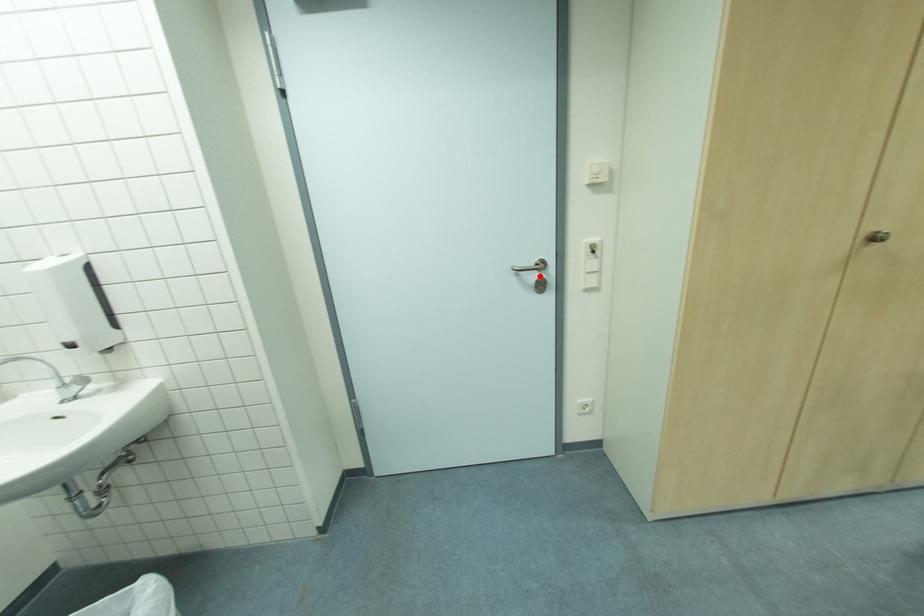
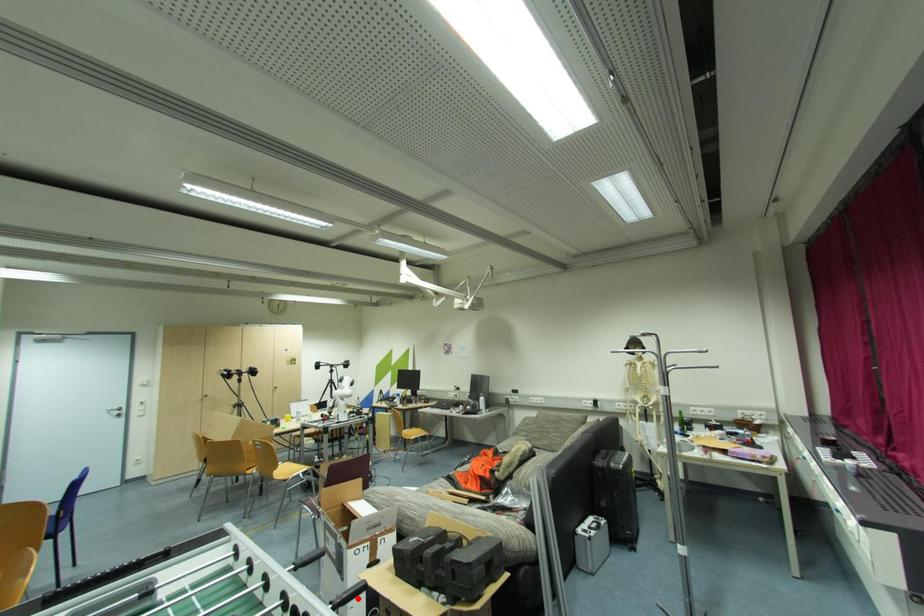
Consider the image. I am providing you with two images of the same scene from different viewpoints. A red point is marked on the first image and another point is marked on the second image. Is the red point in image1 aligned with the point shown in image2?

No